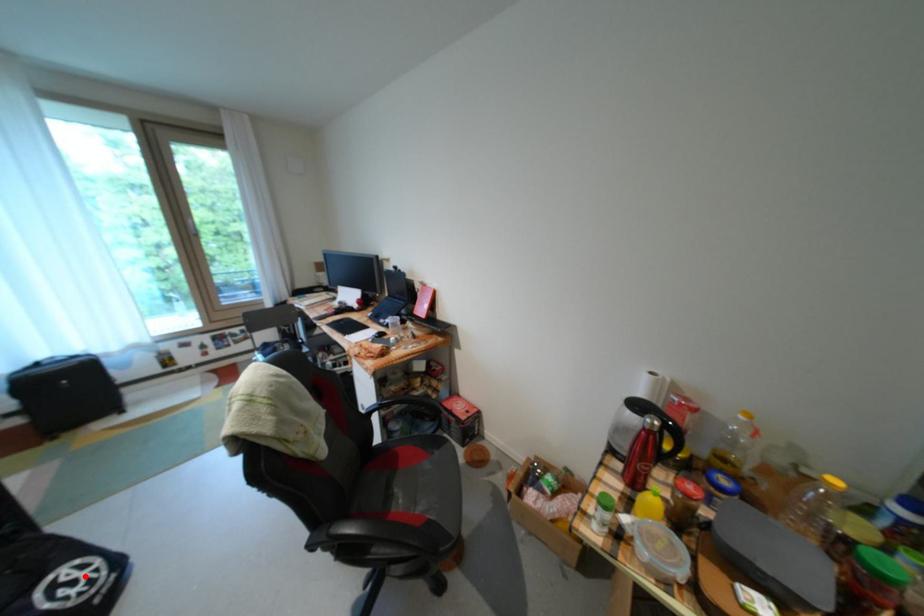
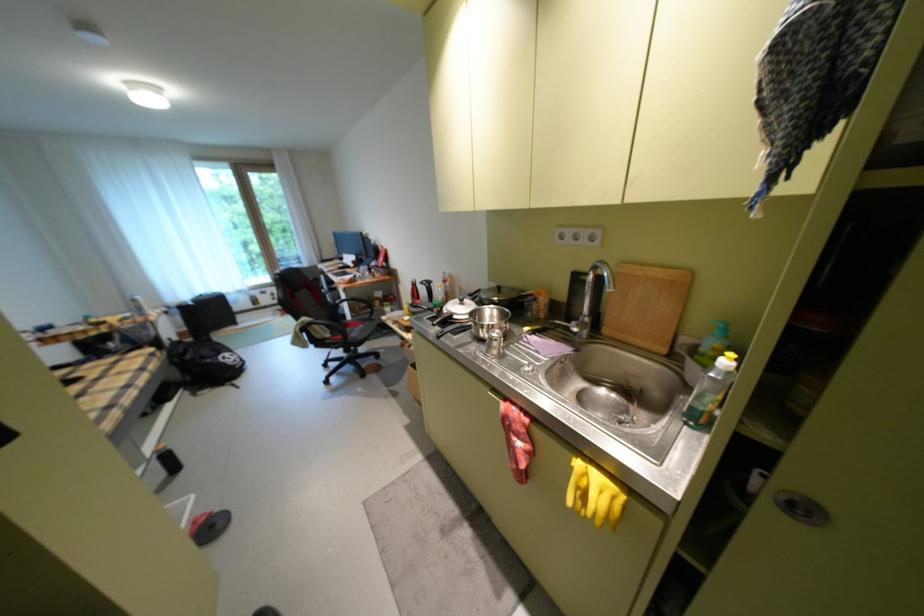
Where in the second image is the point corresponding to the highlighted location from the first image?

(239, 358)